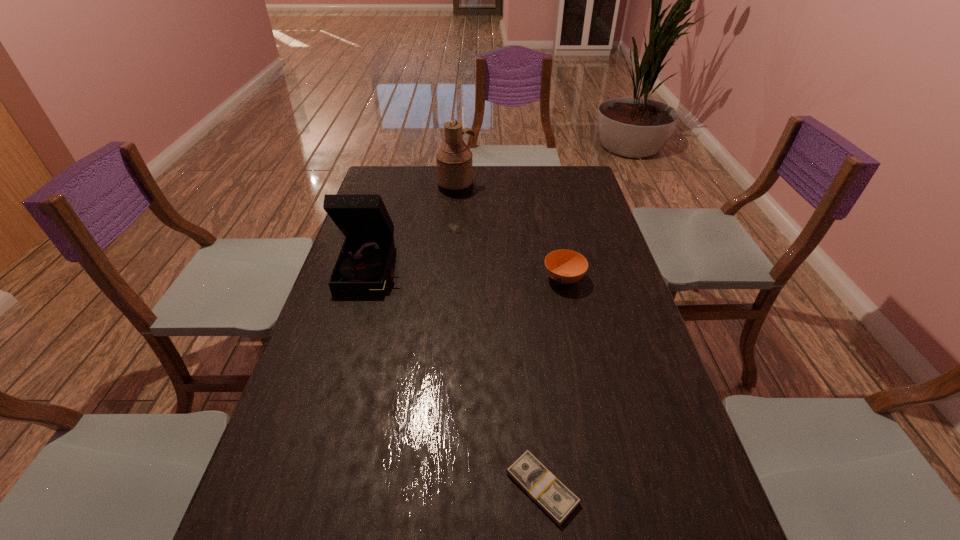
What are the coordinates of `vacant area that lies between the leftmost object and the pitcher` in the screenshot? It's located at (415, 227).

Find the location of a particular element. vacant point located between the leftmost object and the dollar is located at coordinates pos(458,378).

The width and height of the screenshot is (960, 540). Find the location of `free space between the shortest object and the second object from left to right`. free space between the shortest object and the second object from left to right is located at coordinates (499, 338).

Locate an element on the screen. The height and width of the screenshot is (540, 960). free space between the soup bowl and the leftmost object is located at coordinates (468, 273).

You are a GUI agent. You are given a task and a screenshot of the screen. Output one action in this format:
    pyautogui.click(x=<x>, y=<y>)
    Task: Click on the unoccupied position between the second shortest object and the phonograph_record
    Image resolution: width=960 pixels, height=540 pixels.
    Given the screenshot: What is the action you would take?
    468,273

Image resolution: width=960 pixels, height=540 pixels. I want to click on free space between the soup bowl and the leftmost object, so click(468, 273).

Identify which object is the nearest to the leftmost object. Please provide its 2D coordinates. Your answer should be formatted as a tuple, i.e. [(x, y)], where the tuple contains the x and y coordinates of a point satisfying the conditions above.

[(454, 160)]

Select which object appears as the second closest to the farthest object. Please provide its 2D coordinates. Your answer should be formatted as a tuple, i.e. [(x, y)], where the tuple contains the x and y coordinates of a point satisfying the conditions above.

[(564, 266)]

Find the location of a particular element. This screenshot has height=540, width=960. vacant region that satisfies the following two spatial constraints: 1. on the front side of the pitcher; 2. on the right side of the nearest object is located at coordinates (432, 488).

Find the location of a particular element. The width and height of the screenshot is (960, 540). free spot that satisfies the following two spatial constraints: 1. on the front-facing side of the leftmost object; 2. on the left side of the nearest object is located at coordinates (311, 488).